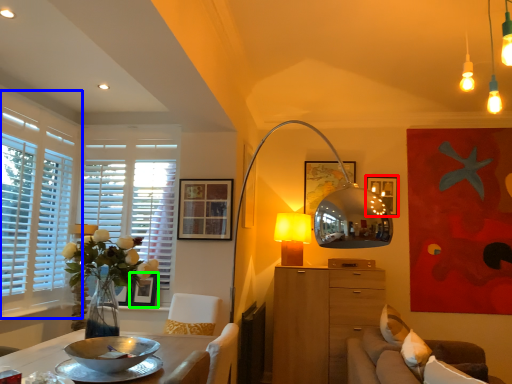
Question: Considering the real-world distances, which object is farthest from picture frame (highlighted by a red box)? window (highlighted by a blue box) or picture frame (highlighted by a green box)?

Choices:
 (A) window
 (B) picture frame

Answer: (A)